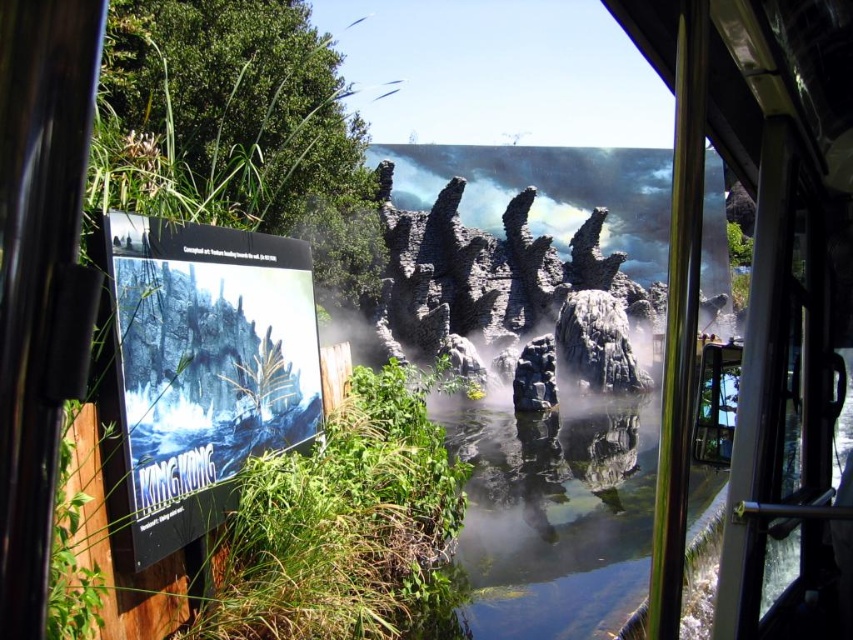
You are a visitor at this themed attraction and want to take a photo of the clear water at center without the green leafy plant at center blocking the view. Is the plant taller than the water, making it likely to block the shot?

The green leafy plant at center is taller than clear water at center, so it will block the view of the clear water at center in your photo.